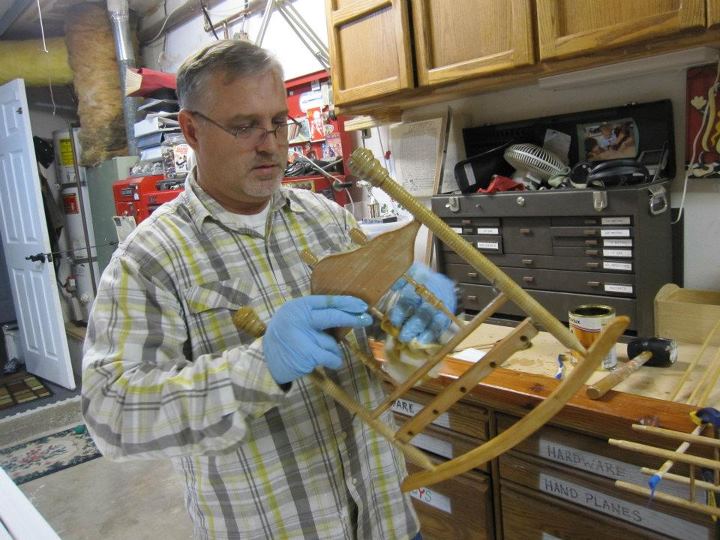
Image resolution: width=720 pixels, height=540 pixels. I want to click on cabinet, so click(x=579, y=424).